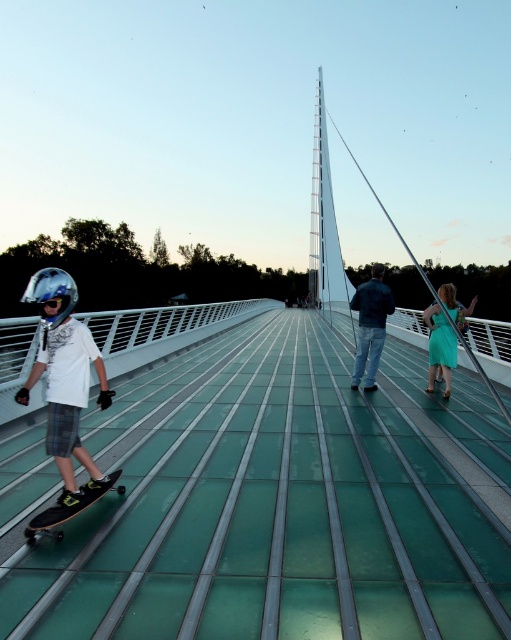
Can you confirm if shiny silver helmet at left is wider than blue jeans at center?

Incorrect, shiny silver helmet at left's width does not surpass blue jeans at center's.

Looking at this image, measure the distance between shiny silver helmet at left and blue jeans at center.

shiny silver helmet at left and blue jeans at center are 6.82 meters apart from each other.

The image size is (511, 640). In order to click on shiny silver helmet at left in this screenshot , I will do `click(64, 378)`.

Locate an element on the screen. This screenshot has height=640, width=511. shiny silver helmet at left is located at coordinates (64, 378).

Is transparent glass bridge at center smaller than teal satin dress at right?

Yes.

Does transparent glass bridge at center appear under teal satin dress at right?

Correct, transparent glass bridge at center is located below teal satin dress at right.

Image resolution: width=511 pixels, height=640 pixels. Describe the element at coordinates (280, 506) in the screenshot. I see `transparent glass bridge at center` at that location.

You are a GUI agent. You are given a task and a screenshot of the screen. Output one action in this format:
    pyautogui.click(x=<x>, y=<y>)
    Task: Click on the transparent glass bridge at center
    This screenshot has height=640, width=511.
    Given the screenshot: What is the action you would take?
    pyautogui.click(x=280, y=506)

Can you confirm if shiny silver helmet at left is taller than silver metallic helmet at left?

In fact, shiny silver helmet at left may be shorter than silver metallic helmet at left.

Is shiny silver helmet at left thinner than silver metallic helmet at left?

Yes, shiny silver helmet at left is thinner than silver metallic helmet at left.

Locate an element on the screen. shiny silver helmet at left is located at coordinates (64, 378).